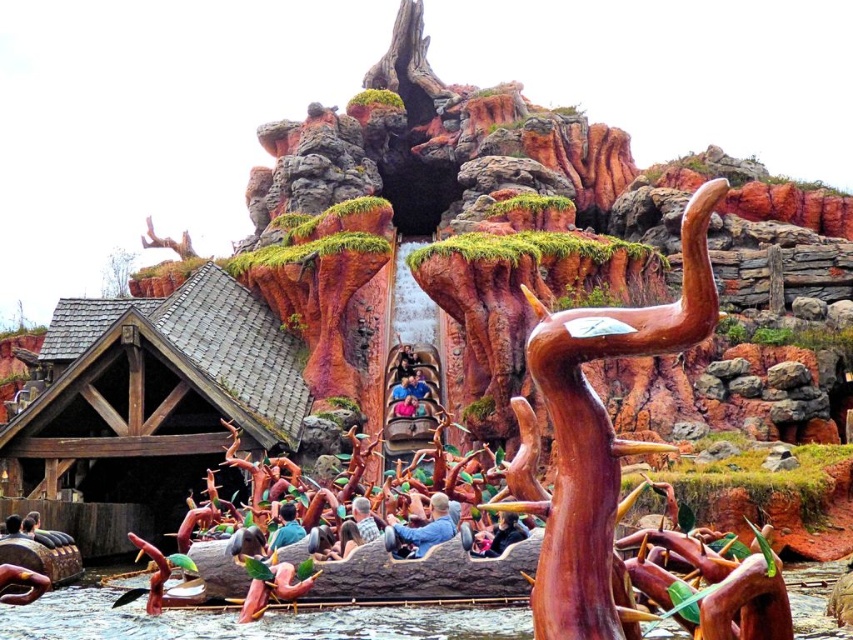
You are standing at the point marked as point [402,524] in the theme park scene. A maintenance worker needs to reach you with a tool that has a 60 meter maximum range. Will the tool be able to reach you?

The distance between point [402,524] and the viewer is 64.57 meters. Since the tool only has a 60 meter range, it cannot reach you.

You are a guest at the theme park and see the blue denim jacket at center and the green mossy tree at upper left. Which object is positioned higher in the image?

The green mossy tree at upper left is positioned higher in the image than the blue denim jacket at center.

You are standing at the origin point of the coordinate system. You want to move towards the brown wood sculpture at upper center. What are the coordinates you need to move to reach it?

The coordinates to reach the brown wood sculpture at upper center are point (598, 436).